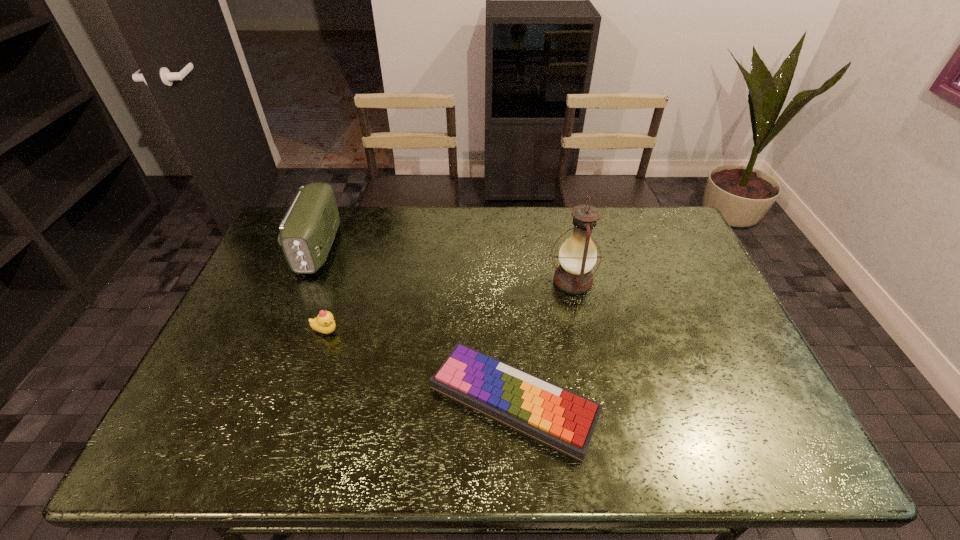
What are the coordinates of `vacant space that is in between the duckling and the computer keyboard` in the screenshot? It's located at (420, 366).

Identify the location of free space between the radio_receiver and the oil lamp. The image size is (960, 540). (445, 265).

Find the location of a particular element. This screenshot has height=540, width=960. vacant area that lies between the shortest object and the second nearest object is located at coordinates (420, 366).

Locate an element on the screen. This screenshot has height=540, width=960. free space between the leftmost object and the nearest object is located at coordinates (417, 324).

Image resolution: width=960 pixels, height=540 pixels. In order to click on unoccupied position between the tallest object and the third farthest object in this screenshot , I will do `click(449, 306)`.

Find the location of `unoccupied position between the computer keyboard and the tallest object`. unoccupied position between the computer keyboard and the tallest object is located at coordinates (543, 341).

I want to click on free area in between the computer keyboard and the third shortest object, so click(417, 324).

I want to click on free space between the radio_receiver and the nearest object, so click(x=417, y=324).

Where is `free space that is in between the oil lamp and the third shortest object`? free space that is in between the oil lamp and the third shortest object is located at coordinates (445, 265).

In order to click on free space between the computer keyboard and the second object from left to right in this screenshot , I will do `click(420, 366)`.